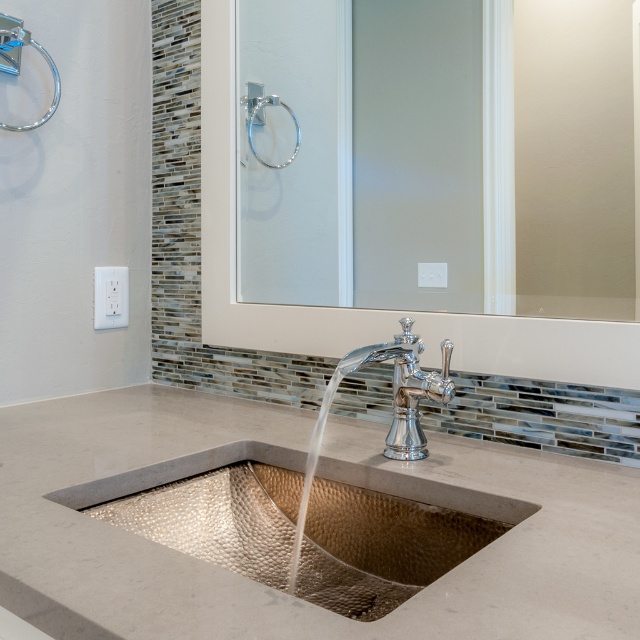
Question: Observing the image, what is the correct spatial positioning of hammered copper sink at center in reference to polished chrome faucet at center?

Choices:
 (A) left
 (B) right

Answer: (A)

Question: Which of these objects is positioned farthest from the hammered copper sink at center?

Choices:
 (A) clear glass mirror at upper center
 (B) polished chrome faucet at center

Answer: (A)

Question: Is hammered copper sink at center to the right of polished chrome faucet at center from the viewer's perspective?

Choices:
 (A) no
 (B) yes

Answer: (A)

Question: Does clear glass mirror at upper center appear on the left side of polished chrome faucet at center?

Choices:
 (A) no
 (B) yes

Answer: (A)

Question: Which of these objects is positioned closest to the hammered copper sink at center?

Choices:
 (A) clear glass mirror at upper center
 (B) polished chrome faucet at center

Answer: (B)

Question: Which of the following is the closest to the observer?

Choices:
 (A) click(38, 586)
 (B) click(531, 74)

Answer: (A)